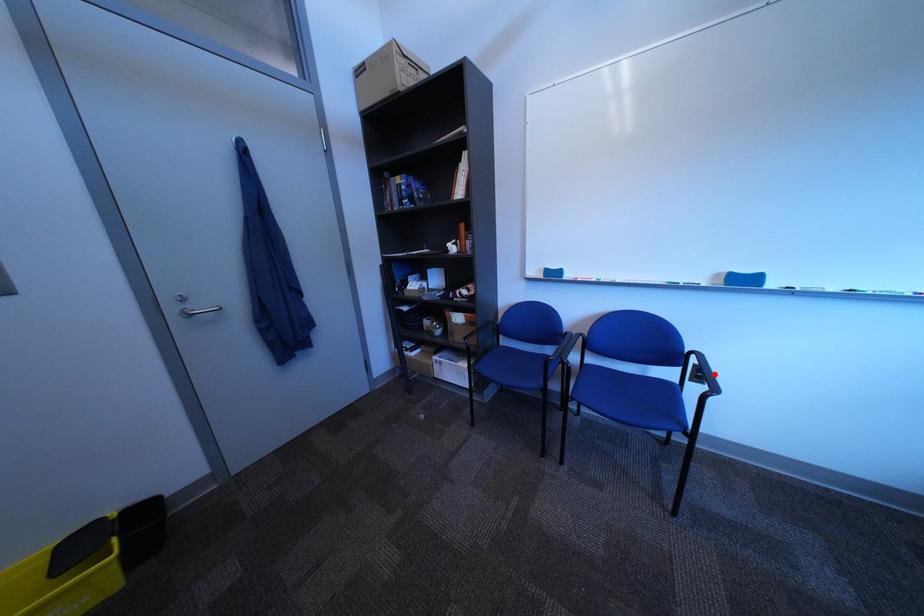
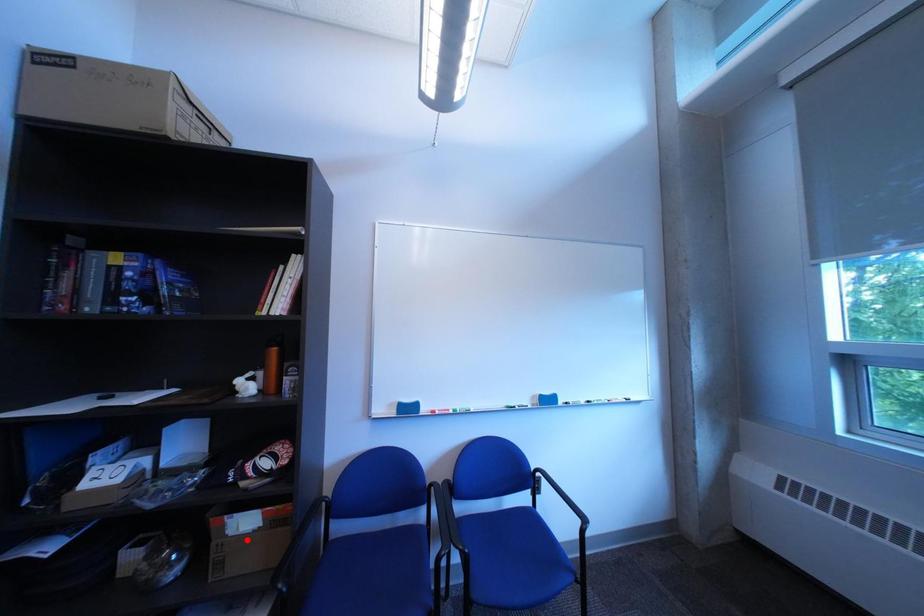
I am providing you with two images of the same scene from different viewpoints. A red point is marked on the first image and another point is marked on the second image. Are the points marked in image1 and image2 representing the same 3D position?

No